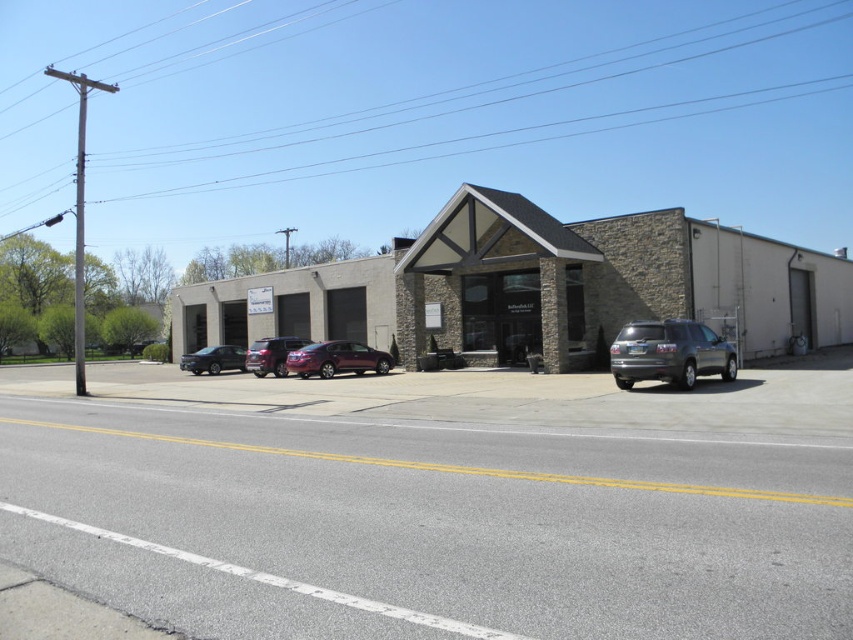
Question: Can you confirm if satin silver suv at right is positioned below metallic purple sedan at center?

Choices:
 (A) yes
 (B) no

Answer: (B)

Question: Can you confirm if satin silver suv at right is positioned to the right of satin burgundy sedan at center?

Choices:
 (A) yes
 (B) no

Answer: (A)

Question: Which point is farther from the camera taking this photo?

Choices:
 (A) (363, 356)
 (B) (198, 349)
 (C) (263, 339)

Answer: (B)

Question: Which point appears closest to the camera in this image?

Choices:
 (A) (712, 349)
 (B) (223, 348)
 (C) (277, 369)

Answer: (A)

Question: Which object is positioned closest to the satin silver suv at right?

Choices:
 (A) satin burgundy sedan at center
 (B) metallic purple sedan at center

Answer: (A)

Question: Does satin burgundy sedan at center appear on the left side of metallic purple sedan at center?

Choices:
 (A) yes
 (B) no

Answer: (B)